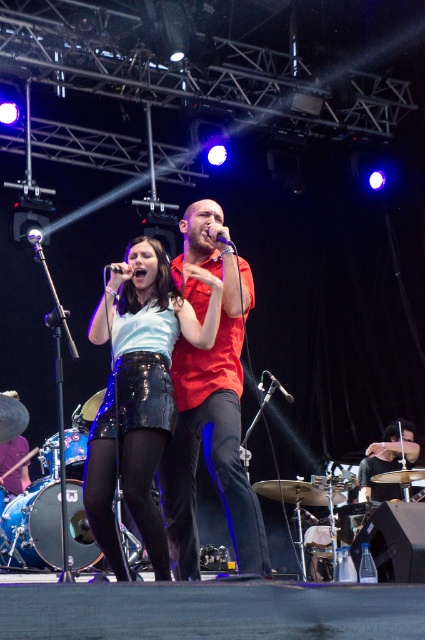
Question: Based on their relative distances, which object is farther from the metallic silver microphone at center?

Choices:
 (A) black plastic microphone at center
 (B) black matte microphone at center
 (C) matte red shirt at center
 (D) shiny black skirt at center

Answer: (B)

Question: Does metallic silver microphone at center appear over black plastic microphone at center?

Choices:
 (A) yes
 (B) no

Answer: (B)

Question: Estimate the real-world distances between objects in this image. Which object is closer to the black plastic microphone at center?

Choices:
 (A) shiny black skirt at center
 (B) black matte microphone at center
 (C) matte red shirt at center

Answer: (C)

Question: Which of the following is the closest to the observer?

Choices:
 (A) matte red shirt at center
 (B) black matte microphone at center

Answer: (A)

Question: Can you confirm if metallic silver microphone at center is bigger than black matte microphone at center?

Choices:
 (A) yes
 (B) no

Answer: (B)

Question: Is matte red shirt at center below black matte microphone at center?

Choices:
 (A) yes
 (B) no

Answer: (A)